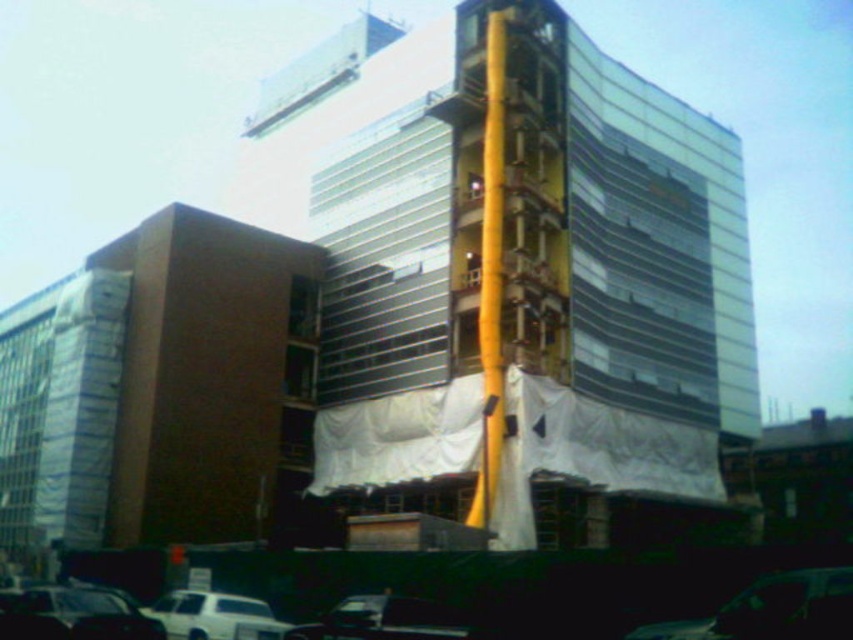
You are a delivery driver approaching the construction site. Your vehicle is a metallic silver car at lower center. The construction site requires all vehicles to stay at least 40 meters away from the building for safety. Are you within the required distance?

The metallic silver car at lower center is 38.87 meters from viewer, which is less than the required 40 meters. Therefore, you are too close and need to move further back to comply with safety regulations.

From the picture: You are a construction worker standing at the base of the building. You notice two points marked on the facade. The first is at point coordinates point [817,634] and the second is at point coordinates point [9,600]. Which point is physically closer to your current position?

Point [817,634] is closer to the viewer than point [9,600], so the first point is physically closer to your current position.